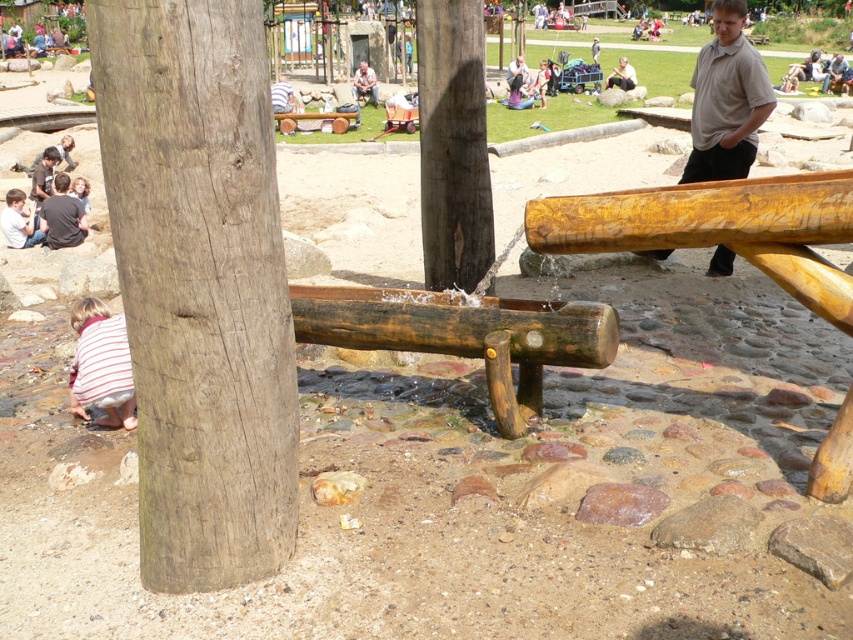
You are a photographer setting up a tripod to capture the water feature and the people in the background. Since you want to include both the matte brown shirt at lower left and the striped fabric child at lower left in the frame, which object should you position closer to the camera to ensure both are visible without moving the tripod?

You should position the matte brown shirt at lower left closer to the camera because it is bigger than the striped fabric child at lower left, ensuring both fit within the frame.

You are a photographer standing at the edge of the water feature. You want to take a photo that includes both the striped shirt at lower left and the striped fabric child at lower left. Which object should you adjust your camera angle to focus on first to ensure both are in frame?

The striped shirt at lower left is below the striped fabric child at lower left, so you should focus on the striped fabric child at lower left first to ensure both are visible in the frame.

You are planning to hang a small birdhouse from one of the objects at the center. Which object between the weathered wood pole at center and the brown wooden bench at center is taller, making it suitable for hanging the birdhouse?

The brown wooden bench at center is taller than the weathered wood pole at center, so it is suitable for hanging the birdhouse.